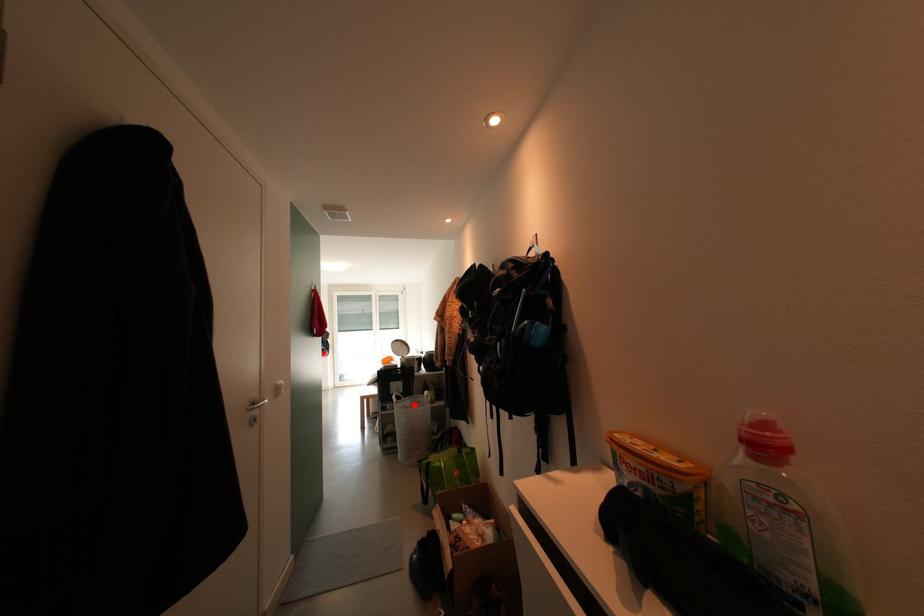
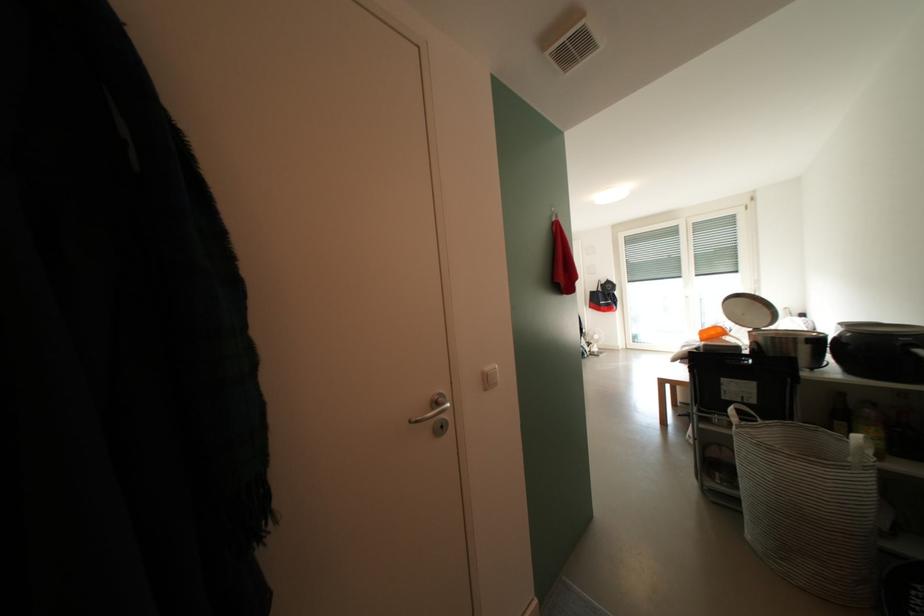
Question: I am providing you with two images of the same scene from different viewpoints. A red point is shown in image1. For the corresponding object point in image2, is it positioned nearer or farther from the camera?

Choices:
 (A) Nearer
 (B) Farther

Answer: (A)